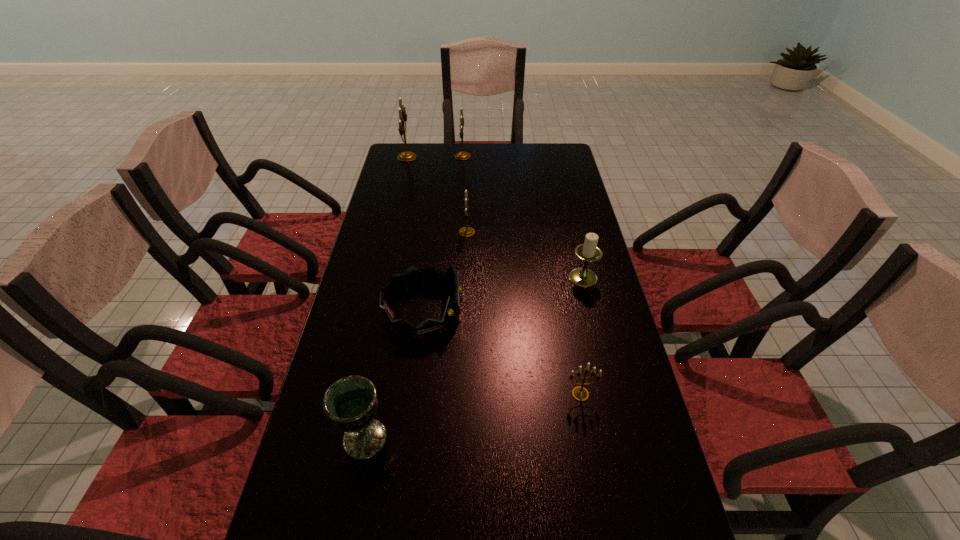
Identify the location of the tallest object. (406, 156).

The height and width of the screenshot is (540, 960). Find the location of `the tallest candelabrum`. the tallest candelabrum is located at coordinates (406, 156).

Identify the location of the second tallest candelabrum. (462, 155).

In order to click on the second tallest object in this screenshot , I will do `click(462, 155)`.

The width and height of the screenshot is (960, 540). In order to click on the third farthest object in this screenshot , I will do `click(466, 231)`.

At what (x,y) coordinates should I click in order to perform the action: click on the third biggest gold candelabrum. Please return your answer as a coordinate pair (x, y). The image size is (960, 540). Looking at the image, I should click on (466, 231).

Locate an element on the screen. This screenshot has width=960, height=540. white candle holder is located at coordinates (589, 252).

You are a GUI agent. You are given a task and a screenshot of the screen. Output one action in this format:
    pyautogui.click(x=<x>, y=<y>)
    Task: Click on the chalice
    
    Given the screenshot: What is the action you would take?
    pyautogui.click(x=350, y=403)

The image size is (960, 540). Find the location of `red tiara`. red tiara is located at coordinates (413, 277).

Find the location of a particular element. The height and width of the screenshot is (540, 960). the shortest candelabrum is located at coordinates (579, 393).